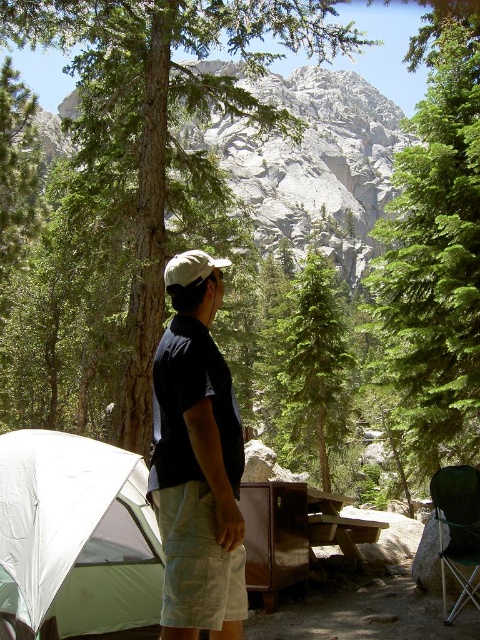
Question: Which point is closer to the camera taking this photo?

Choices:
 (A) (450, 481)
 (B) (346, 524)
 (C) (3, 170)
 (D) (322, 216)

Answer: (A)

Question: Can you confirm if green leafy tree at center is positioned above metallic folding chair at lower right?

Choices:
 (A) no
 (B) yes

Answer: (B)

Question: Which of the following is the closest to the observer?

Choices:
 (A) dark blue t-shirt at center
 (B) metallic folding chair at lower right

Answer: (A)

Question: Which object is positioned farthest from the green rough bark tree at center?

Choices:
 (A) green leafy tree at center
 (B) gray rock mountain at upper center
 (C) metallic folding chair at lower right

Answer: (C)

Question: Does green rough bark tree at center appear under metallic folding chair at lower right?

Choices:
 (A) no
 (B) yes

Answer: (A)

Question: Does green rough bark tree at center appear on the right side of green matte tree at center?

Choices:
 (A) no
 (B) yes

Answer: (A)